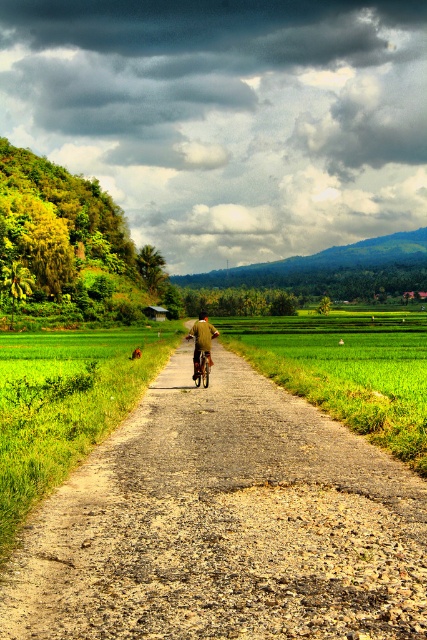
Between brown gravel road at center and brown fabric jacket at center, which one has less height?

brown gravel road at center

Does brown gravel road at center have a lesser width compared to brown fabric jacket at center?

In fact, brown gravel road at center might be wider than brown fabric jacket at center.

Find the location of a particular element. The height and width of the screenshot is (640, 427). brown gravel road at center is located at coordinates (224, 525).